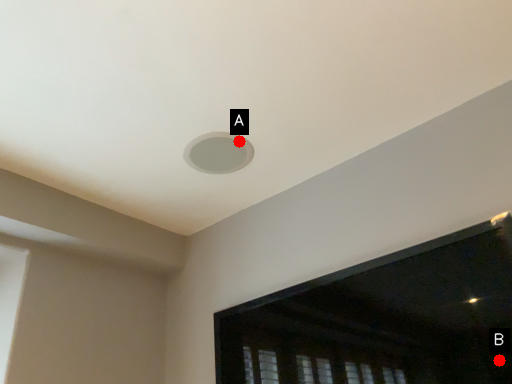
Question: Two points are circled on the image, labeled by A and B beside each circle. Which point is farther to the camera?

Choices:
 (A) A is further
 (B) B is further

Answer: (A)